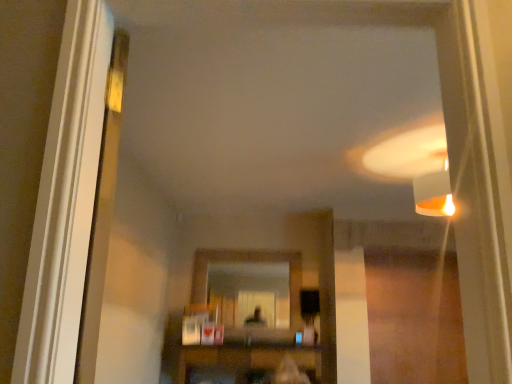
Question: Does point (266, 349) appear closer or farther from the camera than point (236, 301)?

Choices:
 (A) closer
 (B) farther

Answer: (A)

Question: In terms of height, does wooden shelf at center look taller or shorter compared to matte glass mirror at center?

Choices:
 (A) short
 (B) tall

Answer: (A)

Question: Looking at the image, does wooden shelf at center seem bigger or smaller compared to matte glass mirror at center?

Choices:
 (A) big
 (B) small

Answer: (A)

Question: From the image's perspective, is matte glass mirror at center located above or below wooden shelf at center?

Choices:
 (A) above
 (B) below

Answer: (A)

Question: Is matte glass mirror at center situated inside wooden shelf at center or outside?

Choices:
 (A) outside
 (B) inside

Answer: (A)

Question: Is matte glass mirror at center wider or thinner than wooden shelf at center?

Choices:
 (A) wide
 (B) thin

Answer: (B)

Question: Is point (247, 309) closer or farther from the camera than point (186, 375)?

Choices:
 (A) farther
 (B) closer

Answer: (A)